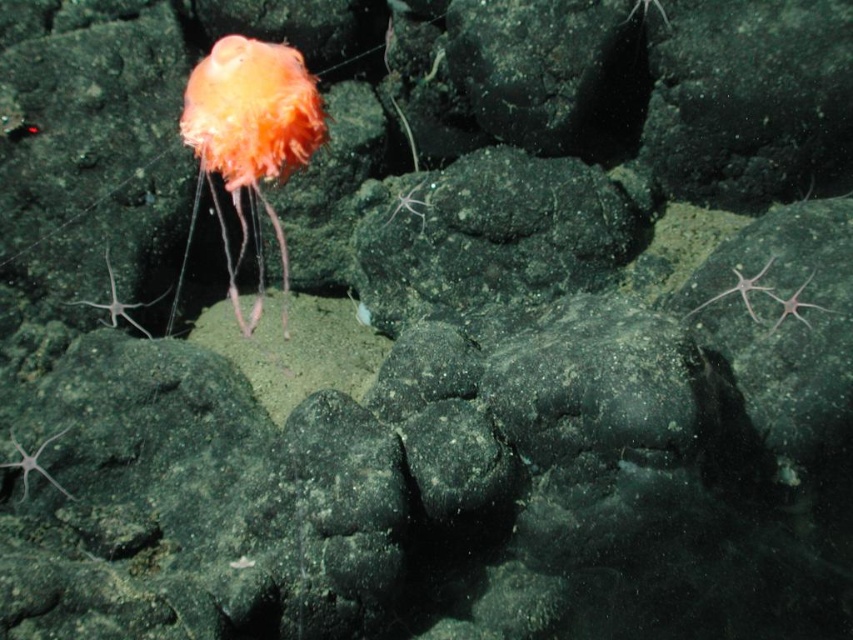
Between orange soft jellyfish at upper left and translucent white starfish at lower right, which one has more height?

orange soft jellyfish at upper left is taller.

Is orange soft jellyfish at upper left to the right of translucent white starfish at lower right from the viewer's perspective?

Incorrect, orange soft jellyfish at upper left is not on the right side of translucent white starfish at lower right.

Which is behind, point (306, 83) or point (820, 308)?

The point (820, 308) is more distant.

Identify the location of orange soft jellyfish at upper left. (248, 141).

Is translucent white starfish at right thinner than translucent white starfish at lower right?

In fact, translucent white starfish at right might be wider than translucent white starfish at lower right.

Between point (766, 291) and point (770, 292), which one is positioned behind?

The point (766, 291) is behind.

Is point (759, 275) closer to viewer compared to point (788, 298)?

No.

You are a GUI agent. You are given a task and a screenshot of the screen. Output one action in this format:
    pyautogui.click(x=<x>, y=<y>)
    Task: Click on the translucent white starfish at right
    The image size is (853, 640).
    Given the screenshot: What is the action you would take?
    pyautogui.click(x=740, y=291)

Between point (224, 51) and point (762, 275), which one is positioned in front?

Point (224, 51) is more forward.

Is orange soft jellyfish at upper left to the left of translucent white starfish at right from the viewer's perspective?

Indeed, orange soft jellyfish at upper left is positioned on the left side of translucent white starfish at right.

Who is more distant from viewer, (177, 300) or (763, 272)?

Positioned behind is point (177, 300).

In order to click on orange soft jellyfish at upper left in this screenshot , I will do `click(248, 141)`.